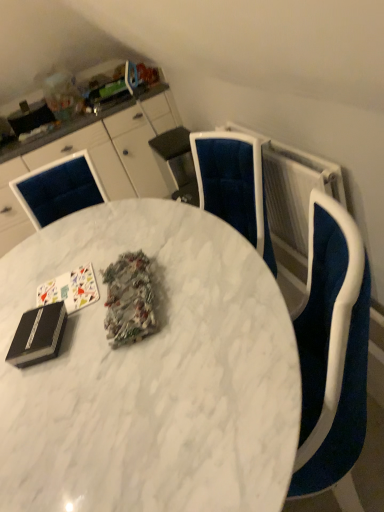
At what (x,y) coordinates should I click in order to perform the action: click on free space between black matte binder at lower left and white matte card game at upper left. Please return your answer as a coordinate pair (x, y). Looking at the image, I should click on (67, 319).